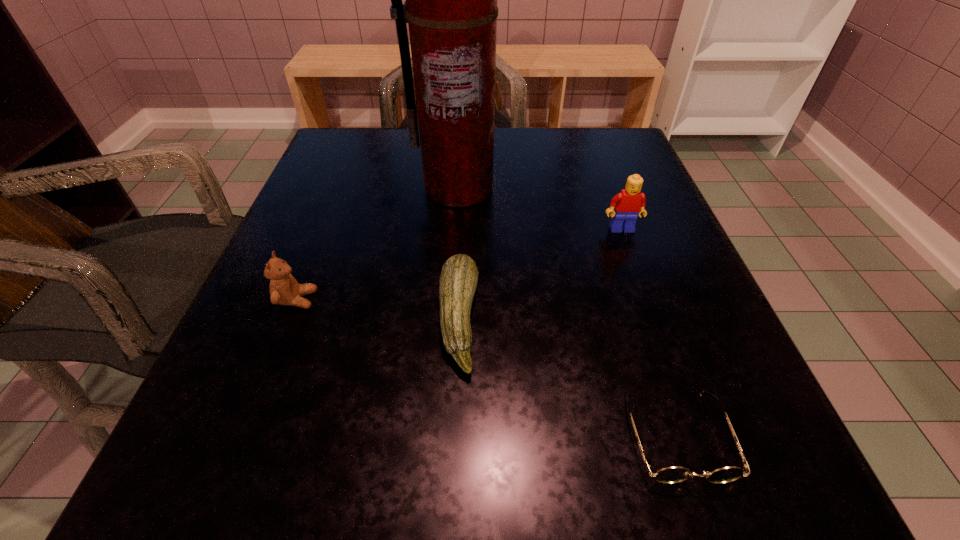
Image resolution: width=960 pixels, height=540 pixels. I want to click on vacant space located 0.230m on the face of the second farthest object, so click(660, 333).

What are the coordinates of `vacant area situated 0.180m on the face of the third tallest object` in the screenshot? It's located at (430, 300).

Locate an element on the screen. This screenshot has width=960, height=540. free space located at the stem end of the zucchini is located at coordinates (711, 320).

The width and height of the screenshot is (960, 540). I want to click on object at the far edge, so click(x=451, y=9).

Where is `object at the near edge`? This screenshot has height=540, width=960. object at the near edge is located at coordinates (669, 475).

Locate an element on the screen. The width and height of the screenshot is (960, 540). object that is at the left edge is located at coordinates (284, 289).

Identify the location of Lego that is at the right edge. Image resolution: width=960 pixels, height=540 pixels. (628, 204).

The height and width of the screenshot is (540, 960). I want to click on spectacles located at the right edge, so click(669, 475).

This screenshot has height=540, width=960. Identify the location of object located at the near right corner. (669, 475).

Locate an element on the screen. free space at the far edge of the desktop is located at coordinates (498, 147).